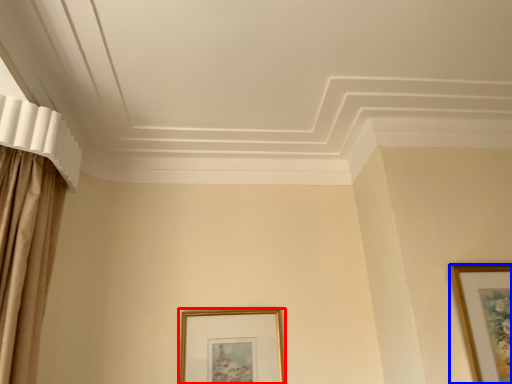
Question: Which of the following is the farthest to the observer, picture frame (highlighted by a red box) or picture frame (highlighted by a blue box)?

Choices:
 (A) picture frame
 (B) picture frame

Answer: (A)